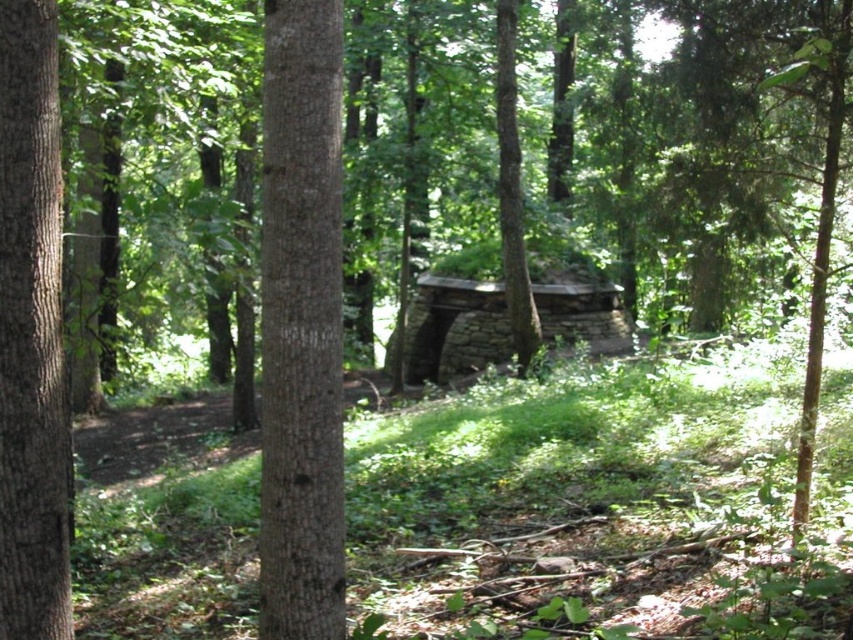
You are a hiker trying to identify two trees in the forest. You see the smooth brown tree trunk at center and the brown rough bark tree at center. Which one is shorter?

The smooth brown tree trunk at center is shorter than the brown rough bark tree at center.

You are a park ranger measuring tree trunks for a study. You have a measuring tape that can only extend 1 meter. You need to determine if the smooth brown tree trunk at center is wider than the brown rough bark tree at left. Can your measuring tape handle both measurements?

The smooth brown tree trunk at center might be wider than brown rough bark tree at left, so the measuring tape that extends 1 meter may or may not be sufficient depending on their actual widths. However, since the question states that the smooth trunk might be wider, there is a possibility it exceeds 1 meter. Therefore, the tape might not be adequate for both.

You are a hiker who wants to take shelter from the rain. You see the rustic stone log cabin at center and the brown rough bark tree at center. Which one would provide better protection from the rain?

The rustic stone log cabin at center has a smaller size compared to brown rough bark tree at center, but the cabin likely offers better shelter due to its roof. However, the description only mentions size, so strictly based on provided info, the answer should focus on size. Wait, the question is about protection from rain. The cabin has a roof, so even if smaller, it would protect better. But the objects description only says the cabin is smaller than the tree. Hmm, but the user instruction says not to add